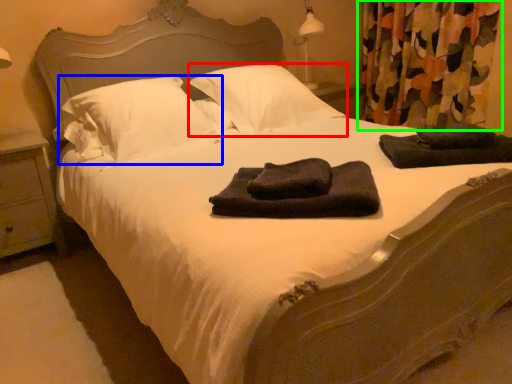
Question: Which object is the closest to the pillow (highlighted by a red box)? Choose among these: pillow (highlighted by a blue box) or curtain (highlighted by a green box).

Choices:
 (A) pillow
 (B) curtain

Answer: (A)